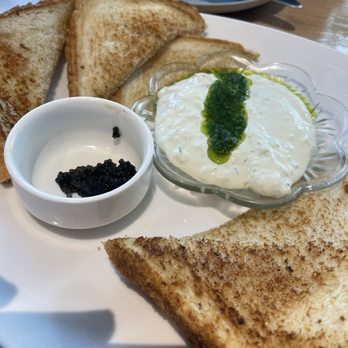
The image size is (348, 348). What are the coordinates of `shadow of bowl on tabletop` in the screenshot? It's located at [81, 233], [124, 223].